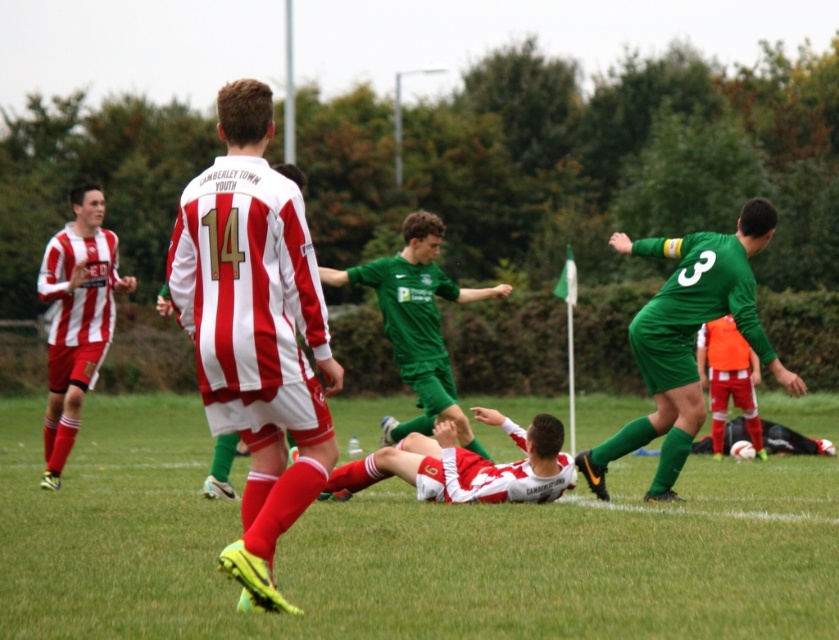
Question: Where is green grass football field at center located in relation to green jersey at center in the image?

Choices:
 (A) below
 (B) above

Answer: (A)

Question: Which object is farther from the camera taking this photo?

Choices:
 (A) green jersey at center
 (B) green matte jersey at right
 (C) green grass football field at center
 (D) matte red and white jersey at center

Answer: (A)

Question: Does striped jersey at left have a greater width compared to matte red and white jersey at center?

Choices:
 (A) no
 (B) yes

Answer: (B)

Question: Which point is closer to the camera taking this photo?

Choices:
 (A) click(x=118, y=403)
 (B) click(x=558, y=456)
 (C) click(x=332, y=380)

Answer: (C)

Question: Among these points, which one is nearest to the camera?

Choices:
 (A) (221, 557)
 (B) (388, 284)
 (C) (456, 460)

Answer: (A)

Question: Is the position of striped jersey at left less distant than that of matte red and white jersey at center?

Choices:
 (A) no
 (B) yes

Answer: (A)